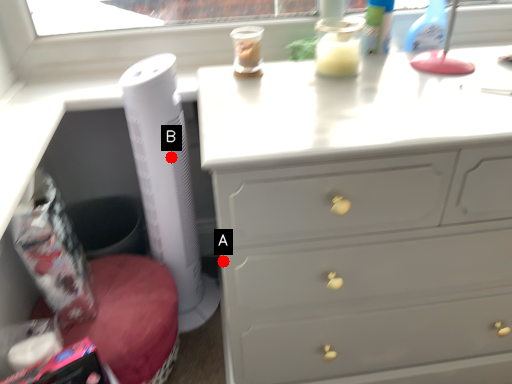
Question: Two points are circled on the image, labeled by A and B beside each circle. Which point appears farthest from the camera in this image?

Choices:
 (A) A is further
 (B) B is further

Answer: (B)